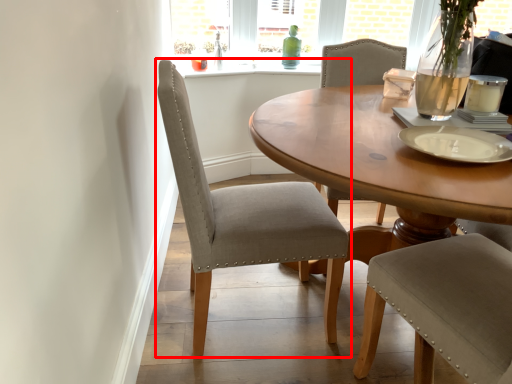
Question: From the image's perspective, where is chair (annotated by the red box) located in relation to platter in the image?

Choices:
 (A) above
 (B) below

Answer: (B)